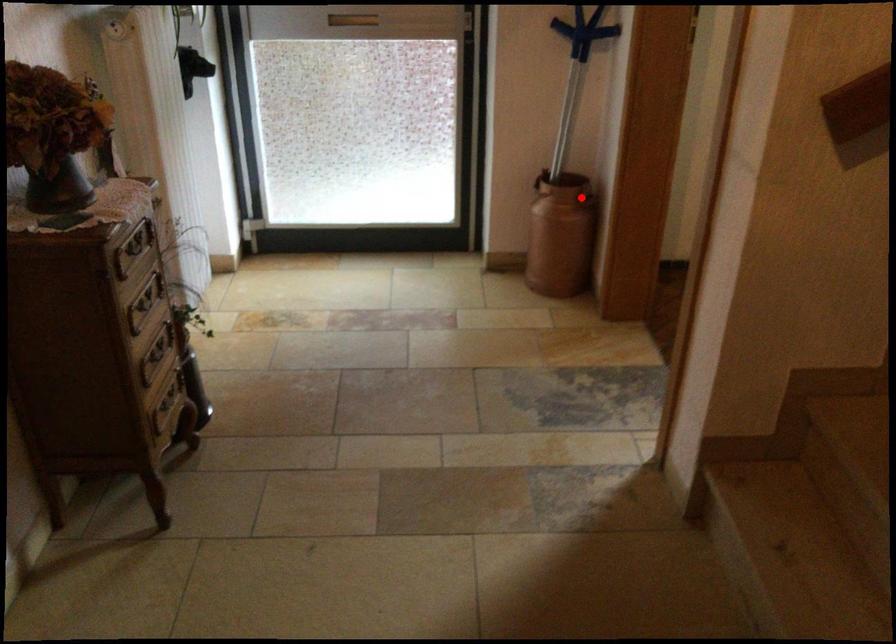
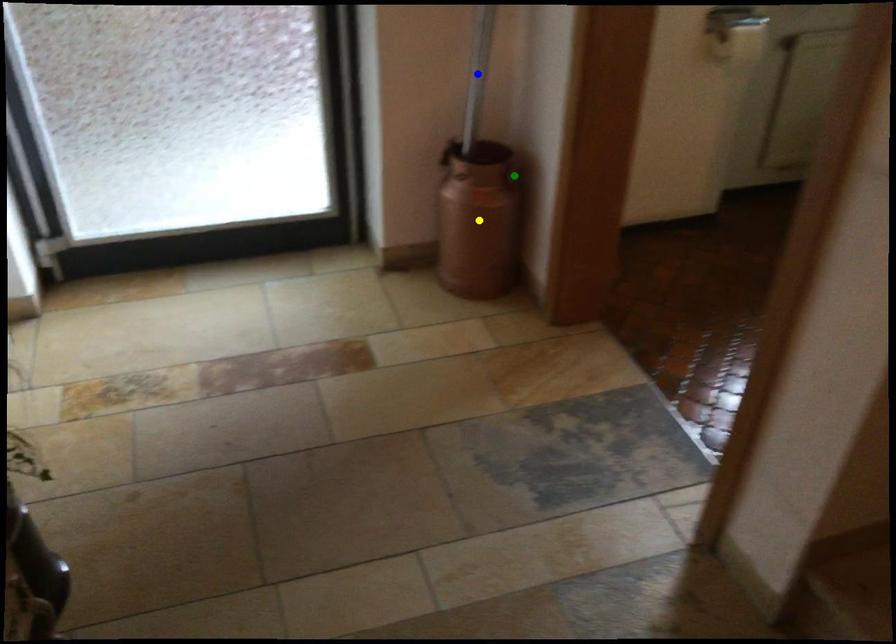
Question: I am providing you with two images of the same scene from different viewpoints. A red point is marked on the first image. You are given multiple points on the second image. Which mark in image 2 goes with the point in image 1?

Choices:
 (A) green point
 (B) blue point
 (C) yellow point

Answer: (A)